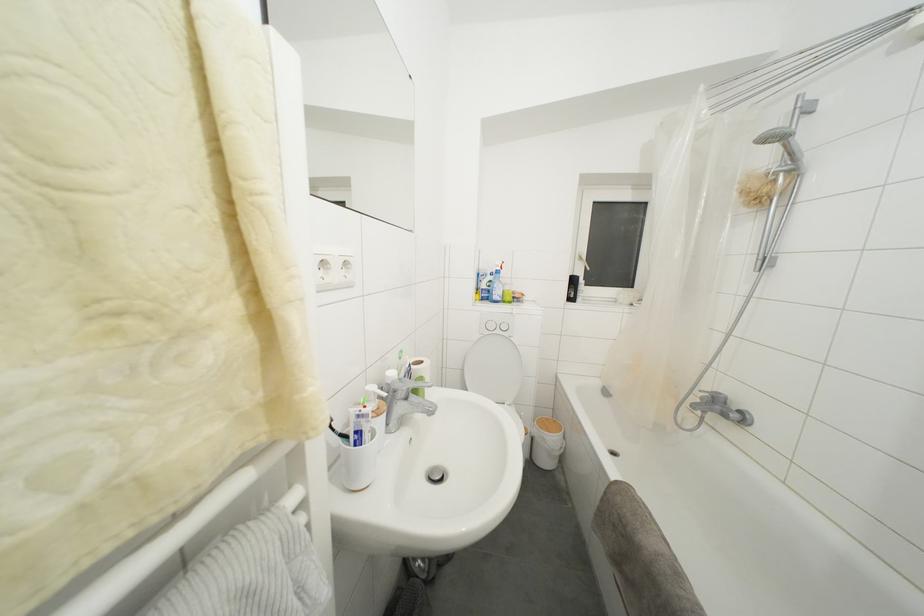
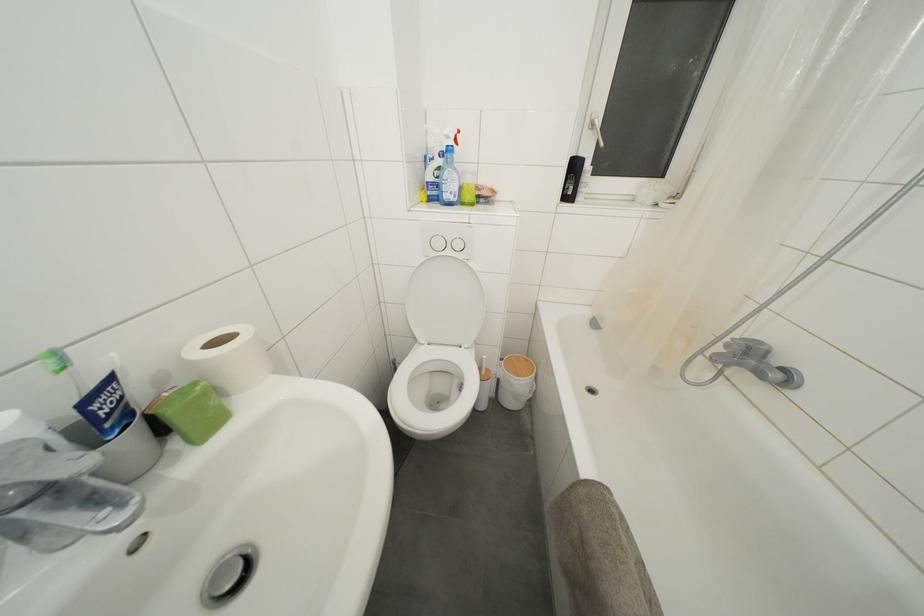
In the second image, find the point that corresponds to pixel 406 357 in the first image.

(61, 359)